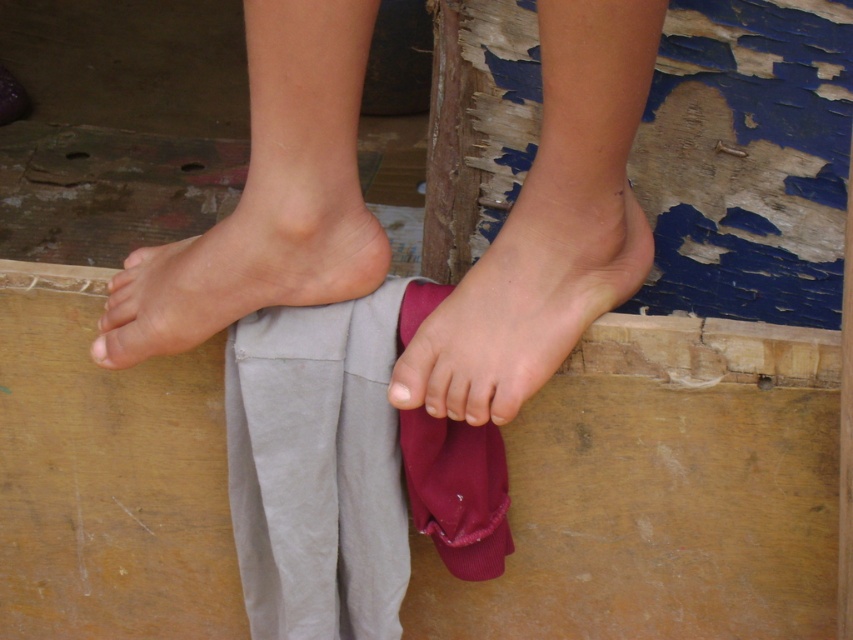
Question: Among these objects, which one is nearest to the camera?

Choices:
 (A) skinny flesh-toned foot at center
 (B) smooth skin toe at center
 (C) smooth skin foot at center

Answer: (C)

Question: Among these objects, which one is nearest to the camera?

Choices:
 (A) smooth skin toe at center
 (B) smooth skin feet at center

Answer: (B)

Question: Can you confirm if maroon fabric at lower center is positioned below pink soft skin at center?

Choices:
 (A) no
 (B) yes

Answer: (B)

Question: Can you confirm if pink soft skin at center is positioned to the right of smooth skin toe at center?

Choices:
 (A) no
 (B) yes

Answer: (B)

Question: Which point is farther to the camera?

Choices:
 (A) pink soft skin at center
 (B) maroon fabric at lower center
 (C) smooth skin toe at center
 (D) smooth skin feet at center

Answer: (C)

Question: Considering the relative positions of smooth skin feet at center and smooth skin toe at center in the image provided, where is smooth skin feet at center located with respect to smooth skin toe at center?

Choices:
 (A) right
 (B) left

Answer: (A)